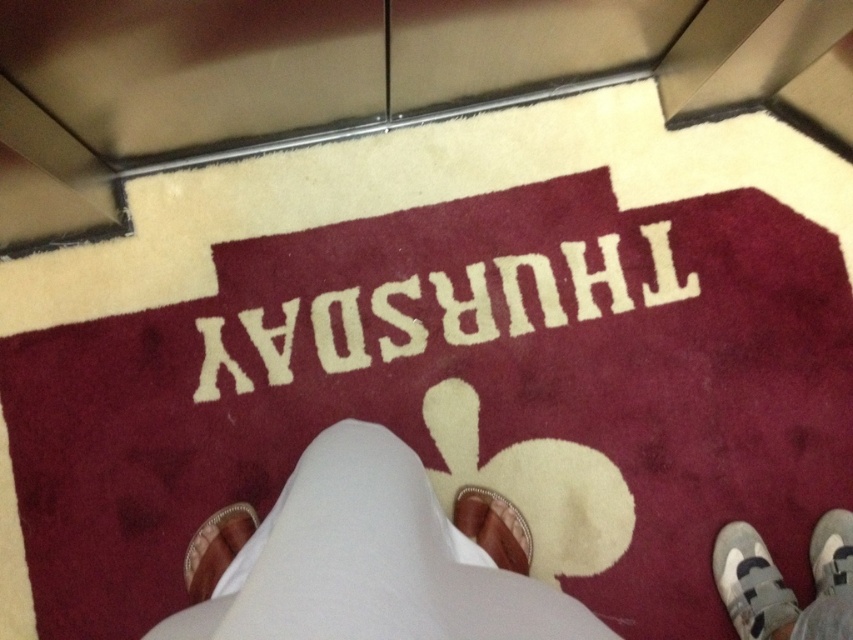
Question: Which point is farther from the camera taking this photo?

Choices:
 (A) (743, 570)
 (B) (285, 522)
 (C) (427, 333)

Answer: (C)

Question: Among these points, which one is nearest to the camera?

Choices:
 (A) (463, 525)
 (B) (212, 385)
 (C) (339, 618)

Answer: (C)

Question: Does white yarn thursday at center lie in front of white fabric shoe at lower right?

Choices:
 (A) yes
 (B) no

Answer: (B)

Question: Is white suede shoe at lower right positioned behind brown leather shoe at center?

Choices:
 (A) no
 (B) yes

Answer: (A)

Question: Does leather at lower left appear under white fabric shoe at lower right?

Choices:
 (A) no
 (B) yes

Answer: (A)

Question: Which of the following is the closest to the observer?

Choices:
 (A) (838, 568)
 (B) (404, 292)
 (C) (438, 561)
 (D) (509, 518)

Answer: (C)